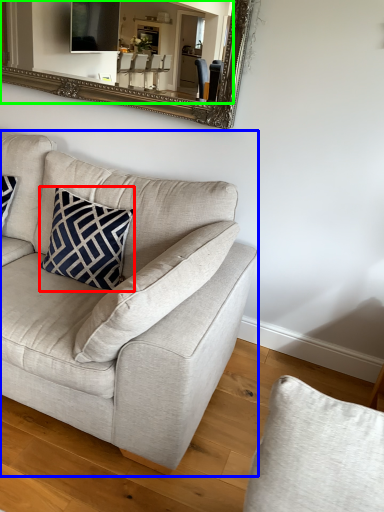
Question: Considering the real-world distances, which object is farthest from pillow (highlighted by a red box)? studio couch (highlighted by a blue box) or mirror (highlighted by a green box)?

Choices:
 (A) studio couch
 (B) mirror

Answer: (B)